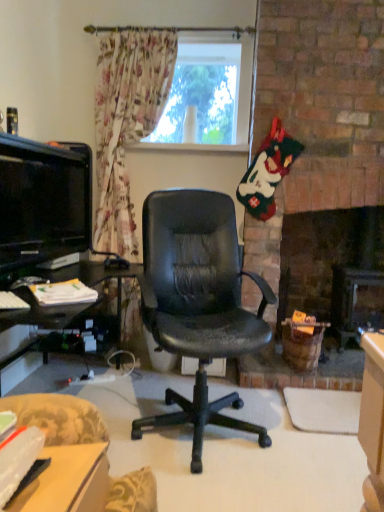
Locate an element on the screen. The width and height of the screenshot is (384, 512). free region under matte plastic desk at lower left (from a real-world perspective) is located at coordinates 57,479.